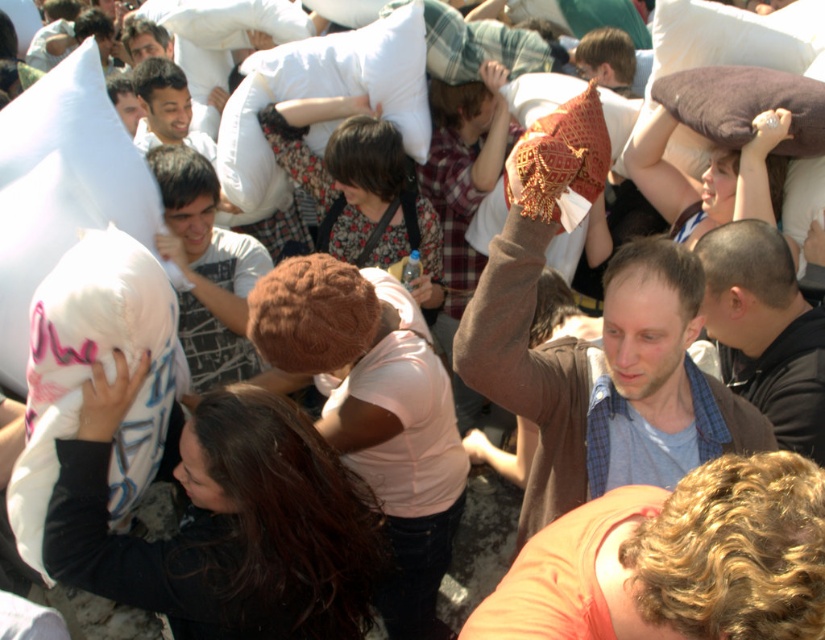
Is brown textured sweater at upper right bigger than brown soft pillow at upper right?

Yes.

This screenshot has height=640, width=825. I want to click on brown textured sweater at upper right, so click(531, 376).

At what (x,y) coordinates should I click in order to perform the action: click on brown textured sweater at upper right. Please return your answer as a coordinate pair (x, y). Looking at the image, I should click on (531, 376).

Between brown textured sweater at upper right and dark gray jacket at center, which one is positioned lower?

brown textured sweater at upper right is lower down.

Is brown textured sweater at upper right below dark gray jacket at center?

Yes.

Which is behind, point (606, 339) or point (729, 339)?

Point (729, 339)

Locate an element on the screen. This screenshot has width=825, height=640. brown textured sweater at upper right is located at coordinates (531, 376).

Is dark gray jacket at center to the left of brown soft pillow at upper right from the viewer's perspective?

Yes, dark gray jacket at center is to the left of brown soft pillow at upper right.

Describe the element at coordinates (765, 330) in the screenshot. The image size is (825, 640). I see `dark gray jacket at center` at that location.

Find the location of a particular element. The height and width of the screenshot is (640, 825). dark gray jacket at center is located at coordinates (765, 330).